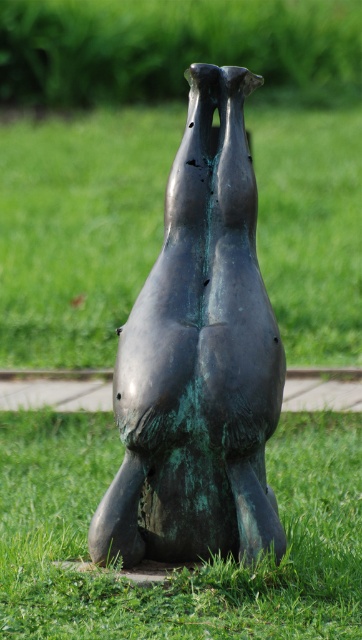
Locate an element on the screen. The image size is (362, 640). green patina bronze sculpture at center is located at coordinates (199, 358).

Can you confirm if green patina bronze sculpture at center is wider than green verdigris statue at center?

In fact, green patina bronze sculpture at center might be narrower than green verdigris statue at center.

Where is `green patina bronze sculpture at center`? The width and height of the screenshot is (362, 640). green patina bronze sculpture at center is located at coordinates pyautogui.click(x=199, y=358).